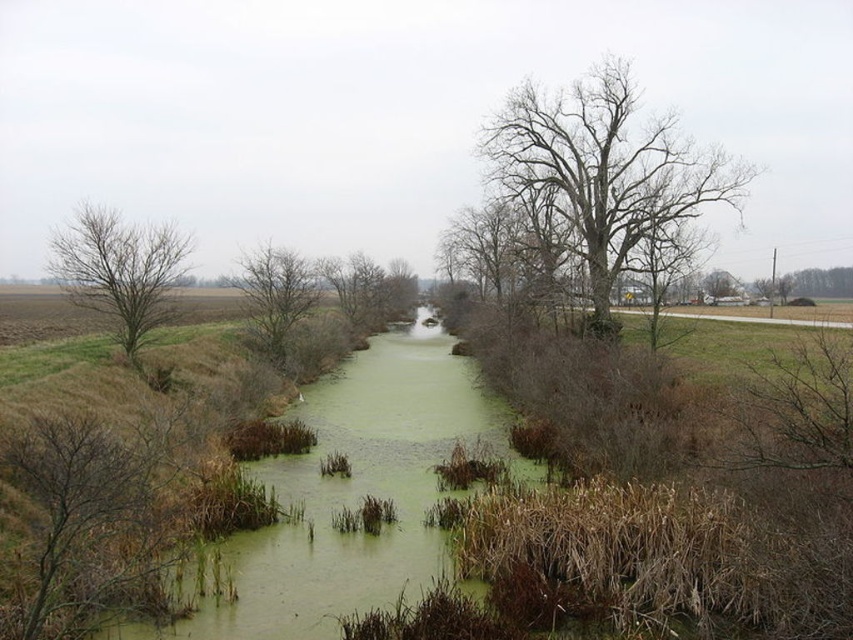
Is point (503, 168) closer to camera compared to point (120, 288)?

No, (503, 168) is further to viewer.

Looking at this image, who is more distant from viewer, (616,248) or (134,339)?

Point (616,248)

In the scene shown: Who is more distant from viewer, (618,250) or (96,218)?

Positioned behind is point (618,250).

Find the location of a particular element. This screenshot has width=853, height=640. bare branches tree at upper center is located at coordinates (607, 172).

Between point (289, 305) and point (350, 310), which one is positioned in front?

Point (289, 305) is in front.

Is bare branches at center positioned at the back of brown leafless tree at center?

No.

Who is more forward, (292,308) or (399,273)?

Point (292,308)

Identify the location of bare branches at center. This screenshot has height=640, width=853. (x=276, y=298).

Is green algae-covered water at center positioned behind brown dry branches at left?

Yes, it is.

Between green algae-covered water at center and brown dry branches at left, which one appears on the right side from the viewer's perspective?

Answer: green algae-covered water at center is more to the right.

Measure the distance between green algae-covered water at center and camera.

green algae-covered water at center is 32.36 feet from camera.

At what (x,y) coordinates should I click in order to perform the action: click on green algae-covered water at center. Please return your answer as a coordinate pair (x, y). This screenshot has width=853, height=640. Looking at the image, I should click on (352, 496).